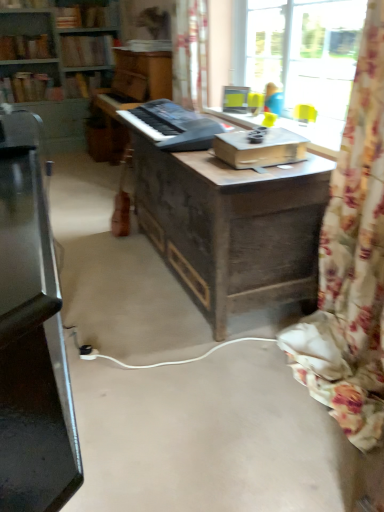
Find the location of a particular element. This screenshot has height=512, width=384. free location in front of brown cardboard book at center is located at coordinates (253, 176).